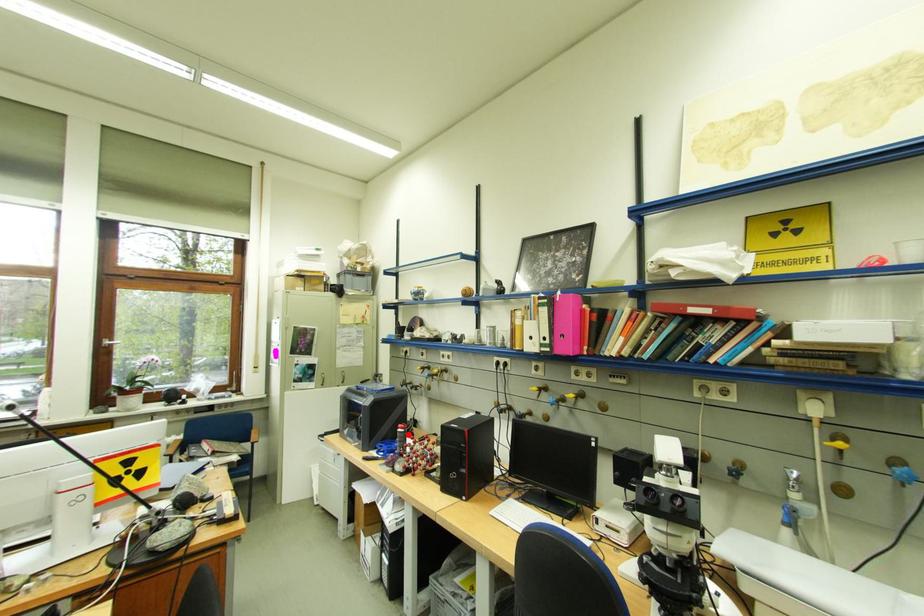
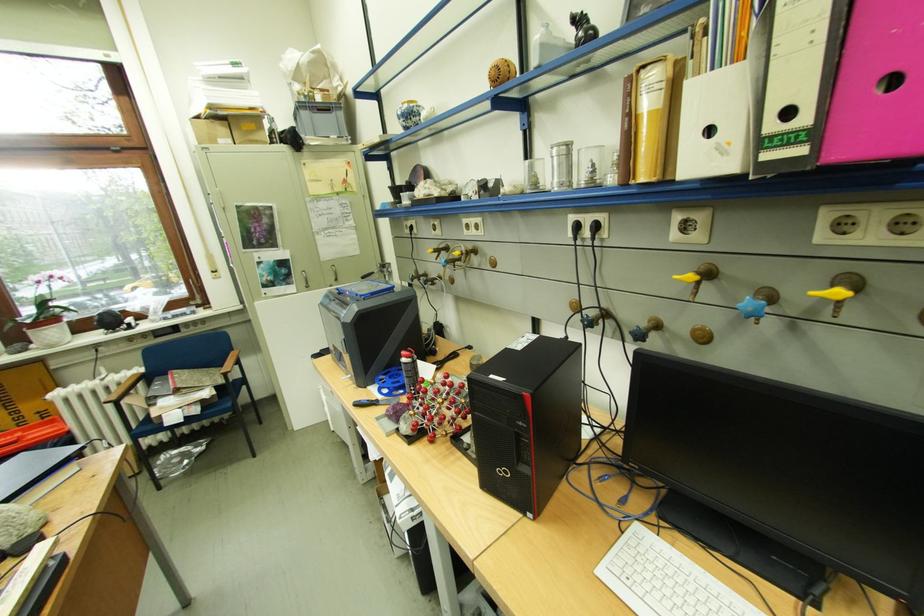
In the second image, find the point that corresponds to the highlighted location in the first image.

(412, 366)